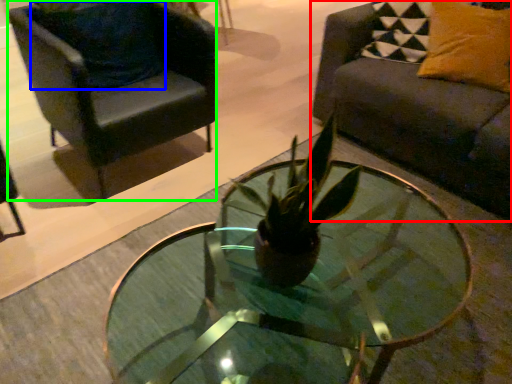
Question: Estimate the real-world distances between objects in this image. Which object is farther from studio couch (highlighted by a red box), pillow (highlighted by a blue box) or chair (highlighted by a green box)?

Choices:
 (A) pillow
 (B) chair

Answer: (A)